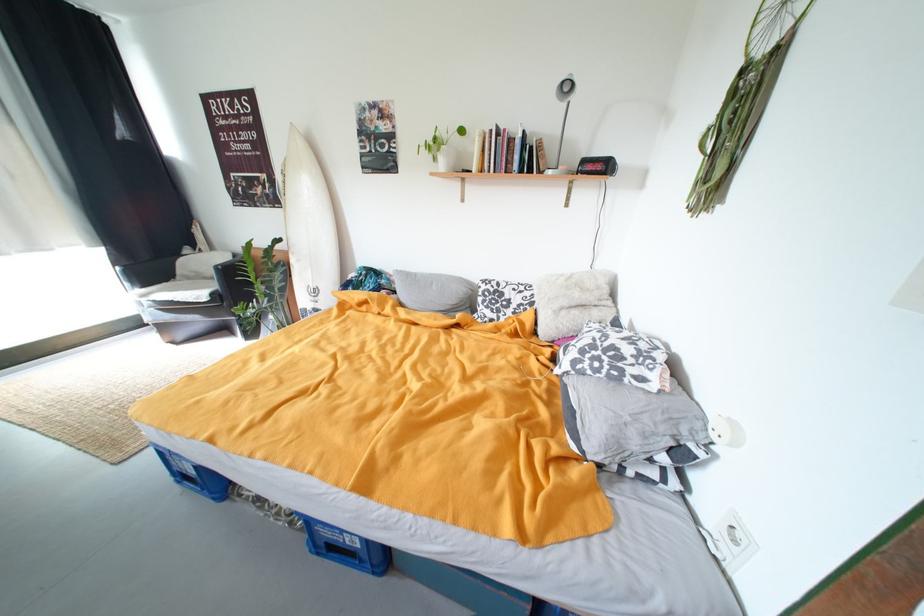
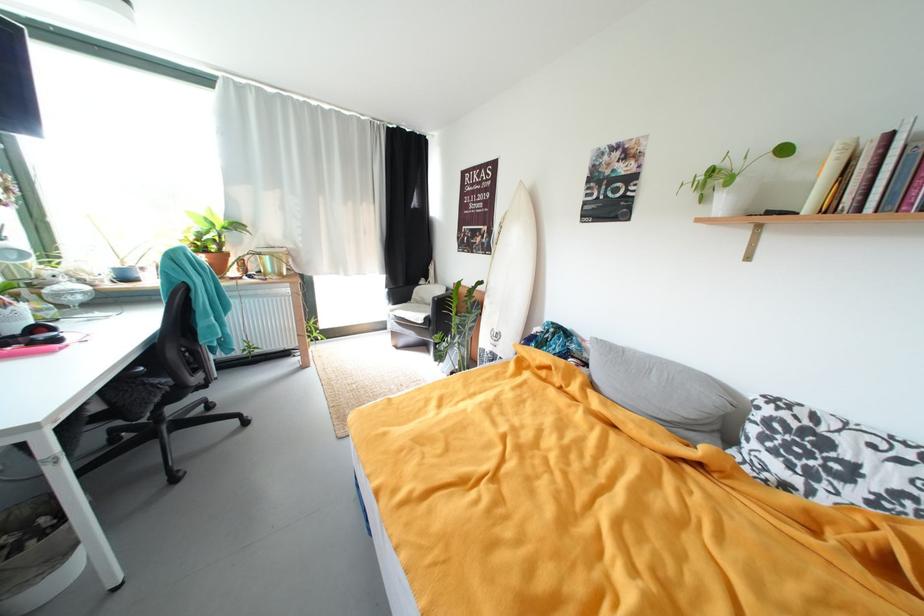
Locate, in the second image, the point that corresponds to pixel 152 297 in the first image.

(399, 313)